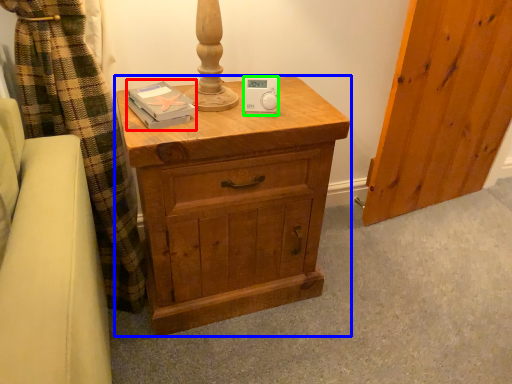
Question: Based on their relative distances, which object is nearer to book (highlighted by a red box)? Choose from chest of drawers (highlighted by a blue box) and ipod (highlighted by a green box).

Choices:
 (A) chest of drawers
 (B) ipod

Answer: (B)